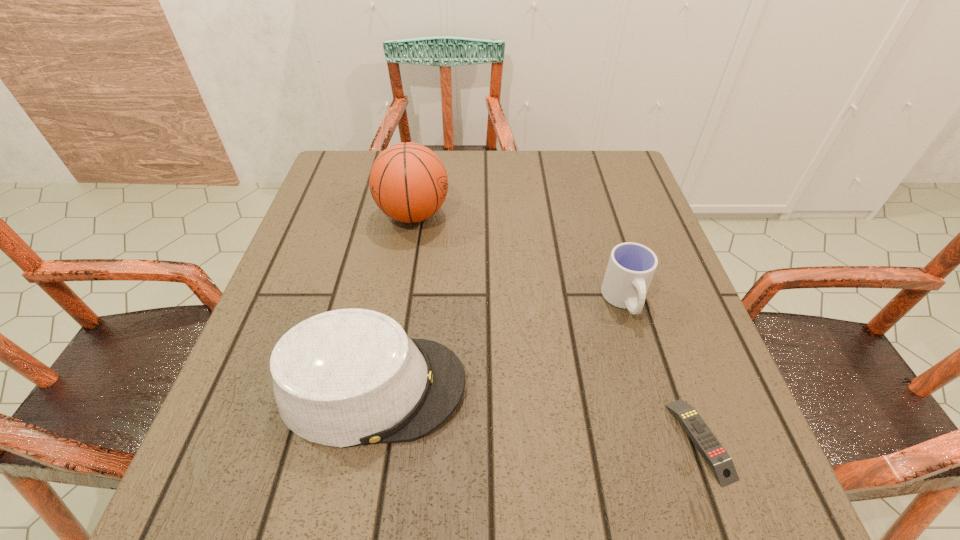
Image resolution: width=960 pixels, height=540 pixels. Find the location of `empty space between the basketball and the shortest object`. empty space between the basketball and the shortest object is located at coordinates (557, 327).

At what (x,y) coordinates should I click in order to perform the action: click on free space between the shortest object and the third nearest object. Please return your answer as a coordinate pair (x, y). The height and width of the screenshot is (540, 960). Looking at the image, I should click on (662, 370).

Identify the location of free space between the hat and the third nearest object. The width and height of the screenshot is (960, 540). (498, 344).

The image size is (960, 540). In order to click on object that is the closest to the basketball in this screenshot , I will do `click(347, 377)`.

Select which object is the third closest to the hat. Please provide its 2D coordinates. Your answer should be formatted as a tuple, i.e. [(x, y)], where the tuple contains the x and y coordinates of a point satisfying the conditions above.

[(720, 462)]

Identify the location of vacant space that satisfies the following two spatial constraints: 1. on the front-facing side of the shortest object; 2. on the left side of the hat. (363, 440).

Identify the location of vacant region that satisfies the following two spatial constraints: 1. with the handle on the side of the second farthest object; 2. on the right side of the shortest object. This screenshot has width=960, height=540. (666, 440).

Locate an element on the screen. vacant space that satisfies the following two spatial constraints: 1. on the front-facing side of the shortest object; 2. on the right side of the hat is located at coordinates point(363,440).

The height and width of the screenshot is (540, 960). What are the coordinates of `vacant area that satisfies the following two spatial constraints: 1. on the front side of the basketball; 2. on the right side of the shortest object` in the screenshot? It's located at (x=375, y=440).

Locate an element on the screen. Image resolution: width=960 pixels, height=540 pixels. blank area in the image that satisfies the following two spatial constraints: 1. on the front-facing side of the hat; 2. on the right side of the remote control is located at coordinates (363, 440).